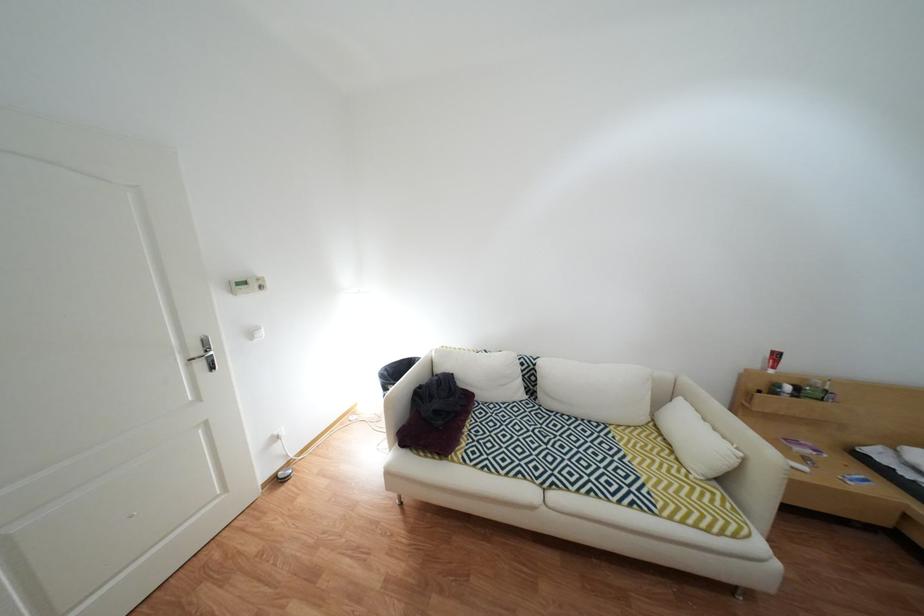
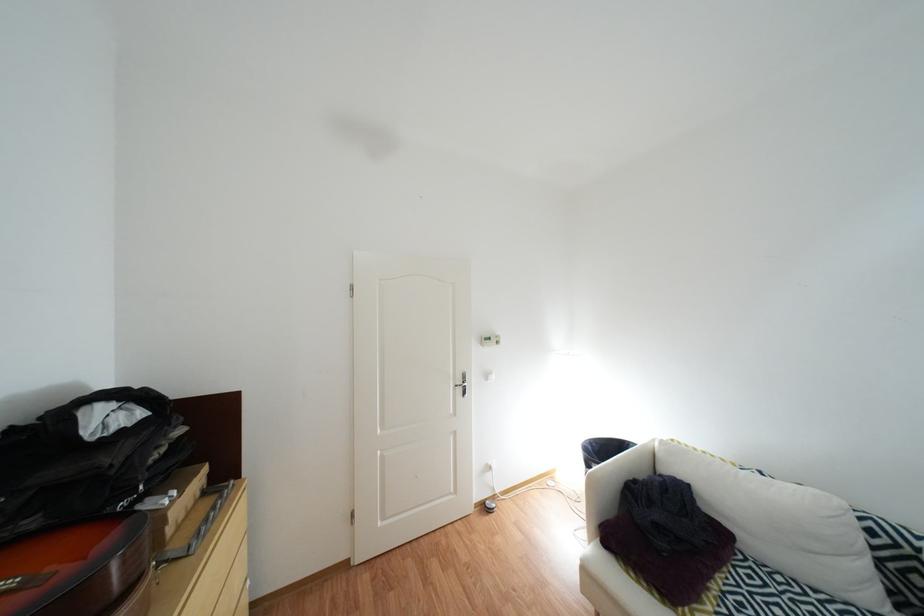
In the second image, find the point that corresponds to pixel 400 390 in the first image.

(603, 466)